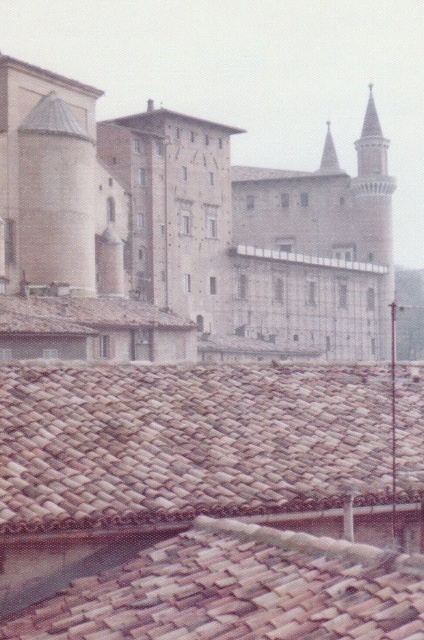
From the picture: Is brown clay tiles at lower center positioned in front of brown tile roof at center?

That is True.

At what (x,y) coordinates should I click in order to perform the action: click on brown clay tiles at lower center. Please return your answer as a coordinate pair (x, y). Looking at the image, I should click on (186, 440).

Between point (320, 420) and point (117, 609), which one is positioned in front?

Positioned in front is point (117, 609).

Who is taller, brown clay tiles at lower center or brown clay tiles at center?

brown clay tiles at lower center is taller.

Image resolution: width=424 pixels, height=640 pixels. What are the coordinates of `brown clay tiles at lower center` in the screenshot? It's located at (186, 440).

Based on the photo, who is lower down, brown clay tiles at center or brown tile roof at center?

Positioned lower is brown clay tiles at center.

Between point (217, 612) and point (120, 307), which one is positioned behind?

The point (120, 307) is more distant.

This screenshot has width=424, height=640. I want to click on brown clay tiles at center, so click(x=239, y=589).